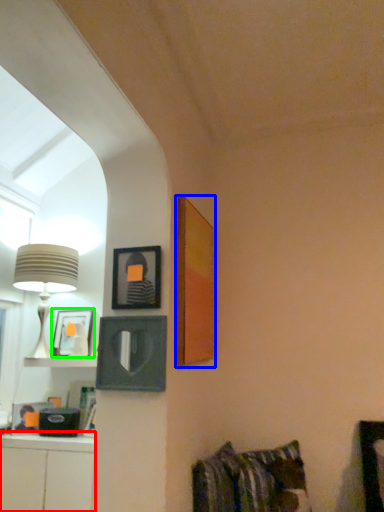
Question: Which is farther away from cabinetry (highlighted by a red box)? picture frame (highlighted by a blue box) or picture frame (highlighted by a green box)?

Choices:
 (A) picture frame
 (B) picture frame

Answer: (A)